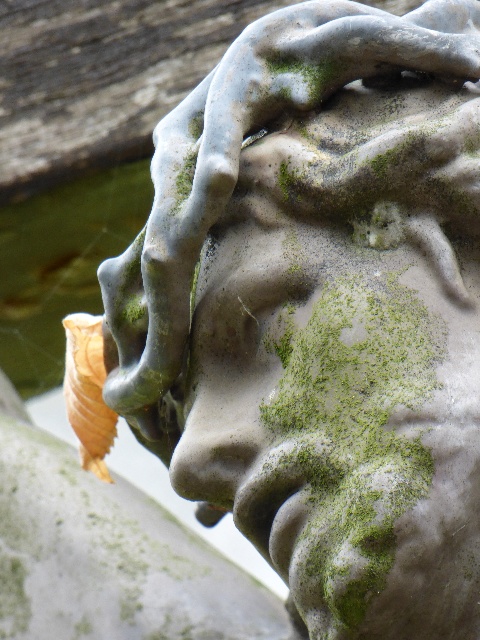
Can you confirm if green mossy stone face at center is taller than orange papery leaf at lower left?

Yes, green mossy stone face at center is taller than orange papery leaf at lower left.

Is green mossy stone face at center to the left of orange papery leaf at lower left from the viewer's perspective?

In fact, green mossy stone face at center is to the right of orange papery leaf at lower left.

This screenshot has width=480, height=640. What do you see at coordinates (338, 426) in the screenshot?
I see `green mossy stone face at center` at bounding box center [338, 426].

Where is `green mossy stone face at center`? The height and width of the screenshot is (640, 480). green mossy stone face at center is located at coordinates (338, 426).